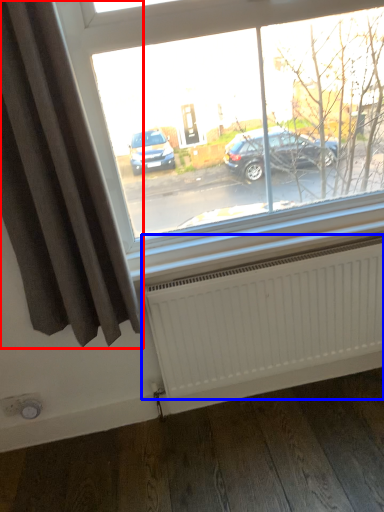
Question: Among these objects, which one is nearest to the camera, curtain (highlighted by a red box) or radiator (highlighted by a blue box)?

Choices:
 (A) curtain
 (B) radiator

Answer: (A)